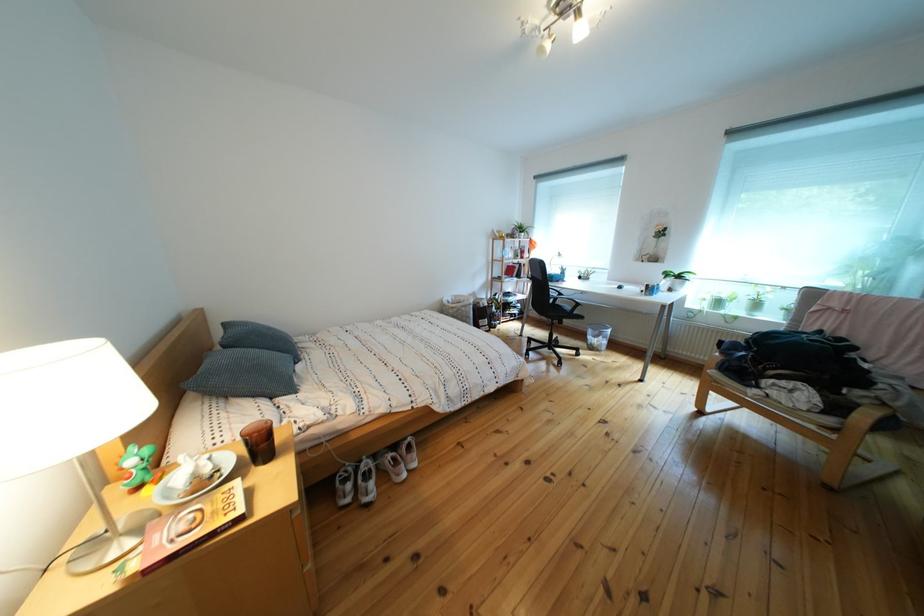
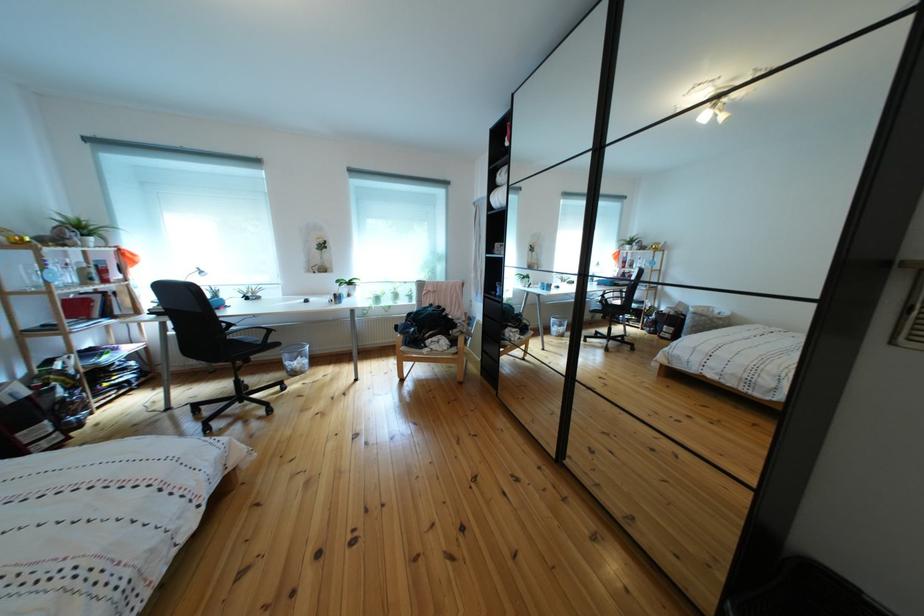
The point at (830, 406) is marked in the first image. Where is the corresponding point in the second image?

(458, 347)